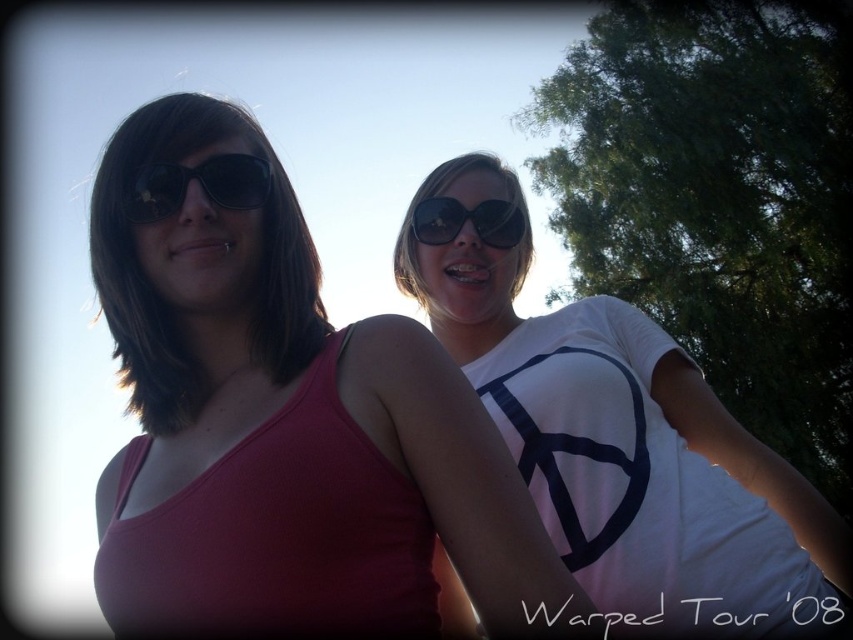
Question: Which object is farther from the camera taking this photo?

Choices:
 (A) black reflective sunglasses at center
 (B) green leafy tree at upper right

Answer: (B)

Question: Does green leafy tree at upper right appear on the left side of black reflective sunglasses at center?

Choices:
 (A) yes
 (B) no

Answer: (B)

Question: Does green leafy tree at upper right appear on the left side of black reflective sunglasses at center?

Choices:
 (A) no
 (B) yes

Answer: (A)

Question: Which object is the farthest from the black reflective sunglasses at center?

Choices:
 (A) green leafy tree at upper right
 (B) matte black tank top at left
 (C) white matte t-shirt at center
 (D) matte black sunglasses at left

Answer: (A)

Question: Which point appears closest to the camera in this image?

Choices:
 (A) (653, 593)
 (B) (242, 209)
 (C) (508, 236)
 (D) (521, 536)

Answer: (D)

Question: Can you confirm if white matte t-shirt at center is smaller than black reflective sunglasses at center?

Choices:
 (A) yes
 (B) no

Answer: (B)